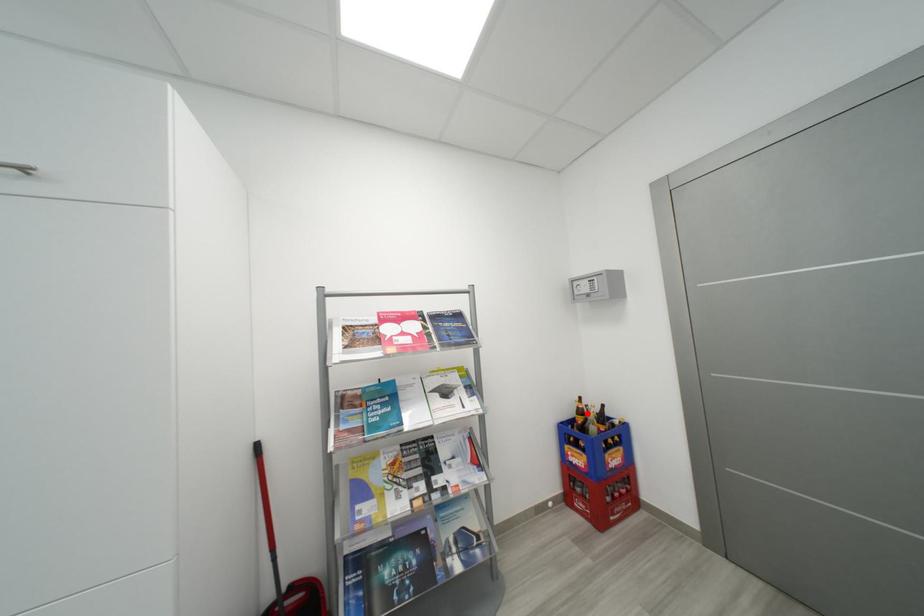
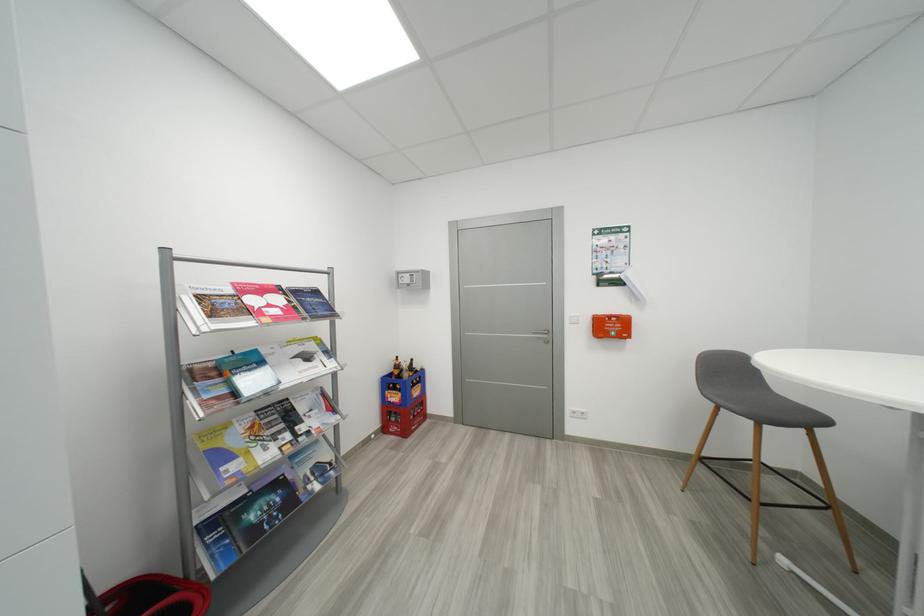
Locate, in the second image, the point that corresponds to the highlighted location in the first image.

(404, 369)